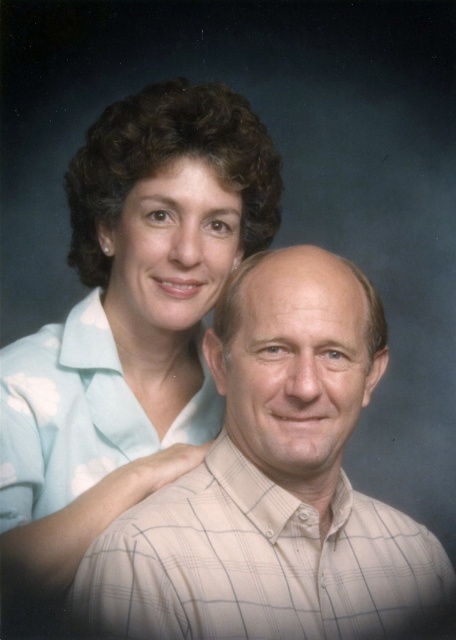
You are a photographer adjusting the lighting in a studio. You notice the white checkered shirt at center and the light blue fabric at upper left in the image. Which object requires more space to accommodate its size?

The white checkered shirt at center requires more space because its width is larger than the light blue fabric at upper left.

From the picture: You are standing 30 inches away from the white checkered shirt at center in the image. Can you comfortably reach out and touch it?

The white checkered shirt at center is 25.40 inches away from the viewer. Since you are standing 30 inches away, you are 4.6 inches further than the shirt, so you cannot comfortably reach out and touch it.

You are a photographer adjusting the lighting in the studio. You need to ensure that both the white checkered shirt at center and the light blue fabric at upper left are well lit. Since the background is dark, which object should you focus the light on first to ensure it stands out more against the dark background?

The white checkered shirt at center should be focused on first because it is positioned on the right side of the light blue fabric at upper left, making it closer to the center of attention where the lighting needs to be more precise.